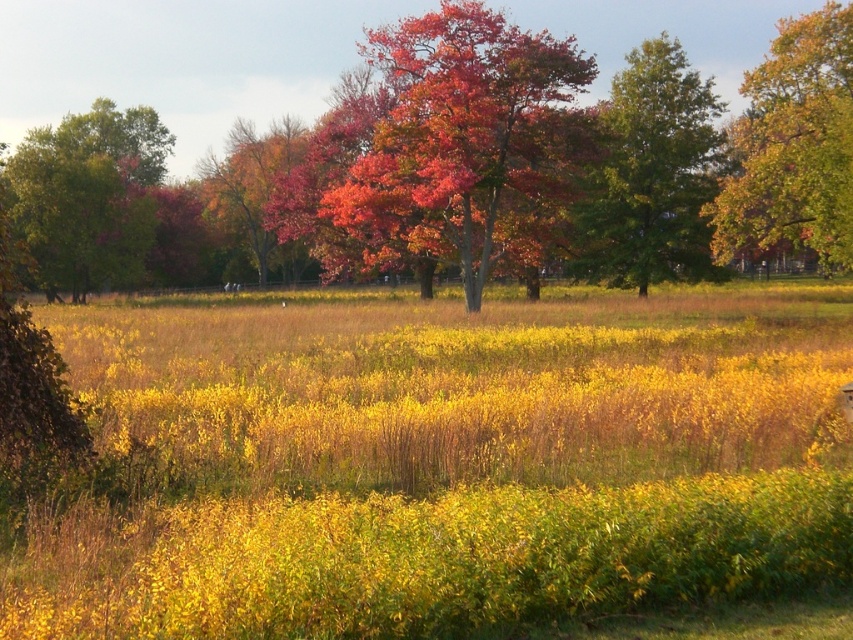
You are an outdoor photographer planning to take a photo of the shiny red leaves at center and the green leafy tree at left. If you want to ensure both subjects are in focus, what should you consider about their distance apart?

The shiny red leaves at center is 60.50 meters away from the green leafy tree at left. To ensure both are in focus, you should use a small aperture setting to increase the depth of field, as the distance between them is significant.

Consider the image. You are an artist trying to capture the autumn scene. You notice the shiny red leaves at center and the golden yellow leaves at upper right. Which set of leaves should you focus on if you want to paint larger leaves in your artwork?

The shiny red leaves at center have a greater width than the golden yellow leaves at upper right, so you should focus on the shiny red leaves at center for larger leaves in your artwork.